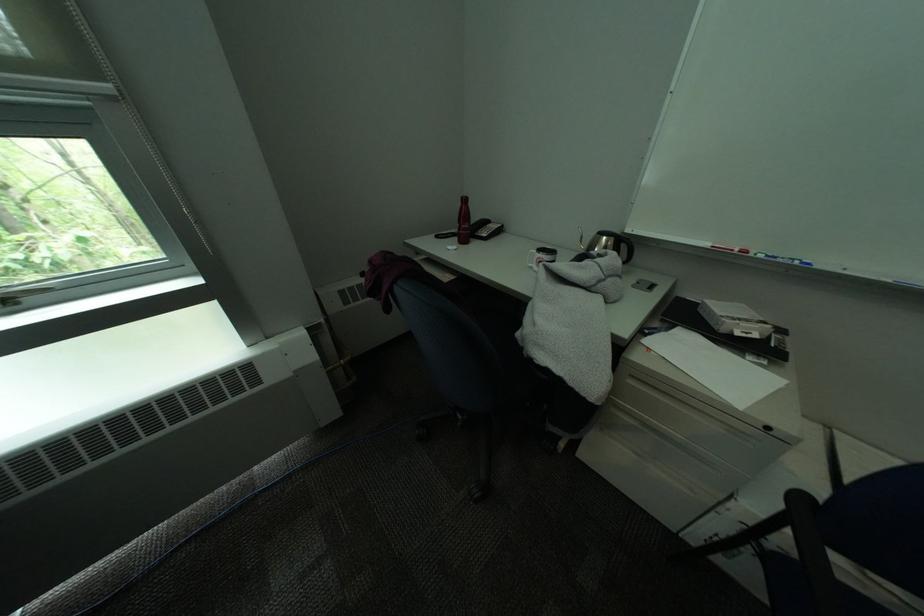
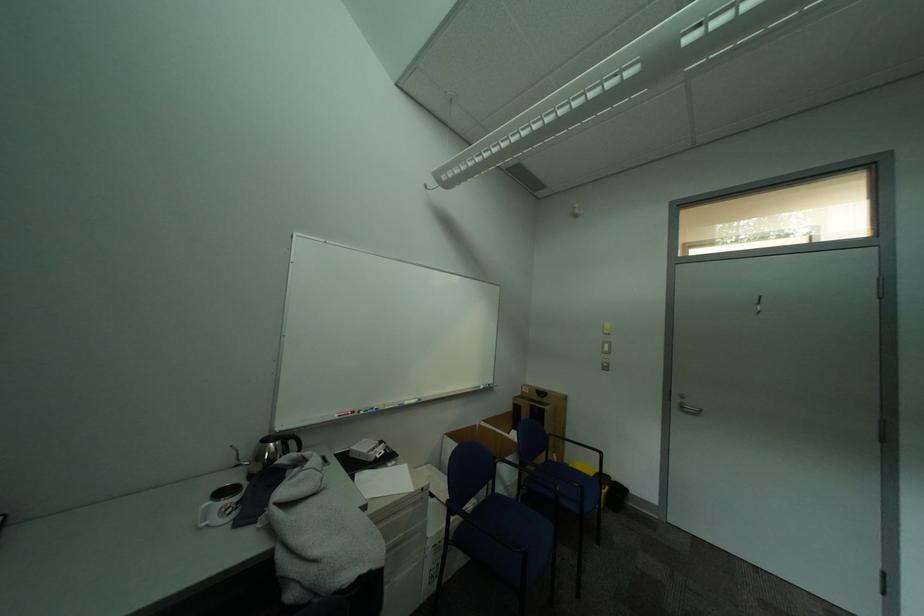
Question: The camera is either moving clockwise (left) or counter-clockwise (right) around the object. The first image is from the beginning of the video and the second image is from the end. Is the camera moving left or right when shooting the video?

Choices:
 (A) Left
 (B) Right

Answer: (A)